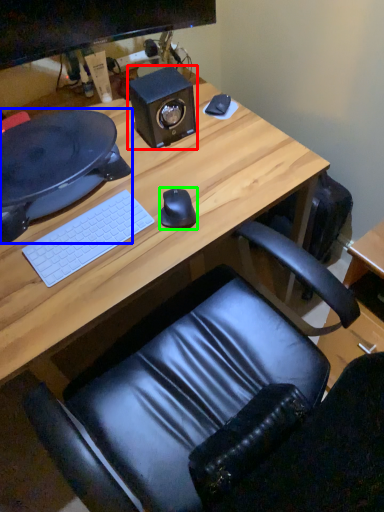
Question: Which object is the closest to the speaker (highlighted by a red box)? Choose among these: desktop (highlighted by a blue box) or mouse (highlighted by a green box).

Choices:
 (A) desktop
 (B) mouse

Answer: (A)